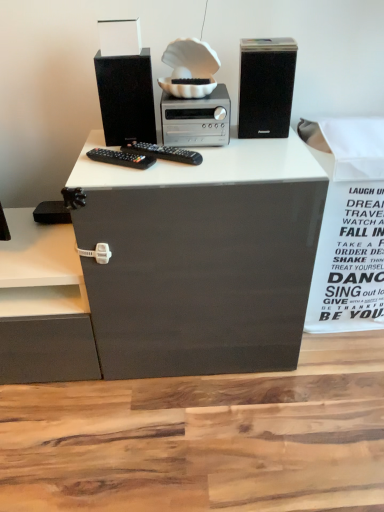
What is the approximate width of black matte speaker at upper right, the 2th computer tower when ordered from left to right?

The width of black matte speaker at upper right, the 2th computer tower when ordered from left to right, is 5.47 inches.

Identify the location of white paper at right. (348, 226).

Identify the location of silver metallic stereo at center. Image resolution: width=384 pixels, height=512 pixels. (196, 119).

Describe the element at coordinates (126, 98) in the screenshot. I see `matte black speaker at upper left, which ranks as the 1th computer tower in left-to-right order` at that location.

Identify the location of black matte speaker at upper right, which is the 1th computer tower in right-to-left order. (266, 87).

Is black matte speaker at upper right, the 2th computer tower when ordered from left to right, in front of or behind silver metallic stereo at center in the image?

Clearly, black matte speaker at upper right, the 2th computer tower when ordered from left to right, is in front of silver metallic stereo at center.

Would you say black matte speaker at upper right, the 2th computer tower when ordered from left to right, is to the left or to the right of silver metallic stereo at center in the picture?

From the image, it's evident that black matte speaker at upper right, the 2th computer tower when ordered from left to right, is to the right of silver metallic stereo at center.

This screenshot has width=384, height=512. Identify the location of the 2nd computer tower positioned above the silver metallic stereo at center (from the image's perspective). (266, 87).

Are black matte speaker at upper right, the 2th computer tower when ordered from left to right, and silver metallic stereo at center beside each other?

There is a gap between black matte speaker at upper right, the 2th computer tower when ordered from left to right, and silver metallic stereo at center.

Can you confirm if black matte speaker at upper right, the 2th computer tower when ordered from left to right, is positioned to the right of matte black speaker at upper left, the second computer tower from the right?

Correct, you'll find black matte speaker at upper right, the 2th computer tower when ordered from left to right, to the right of matte black speaker at upper left, the second computer tower from the right.

Where is `computer tower that is in front of the black matte speaker at upper right, the 2th computer tower when ordered from left to right`? This screenshot has height=512, width=384. computer tower that is in front of the black matte speaker at upper right, the 2th computer tower when ordered from left to right is located at coordinates (126, 98).

Is black matte speaker at upper right, the 2th computer tower when ordered from left to right, taller than matte black speaker at upper left, which ranks as the 1th computer tower in left-to-right order?

Yes.

From a real-world perspective, which object stands above the other?

In real-world perspective, black matte speaker at upper right, the 2th computer tower when ordered from left to right, is above.

Is silver metallic stereo at center oriented away from white paper at right?

No, white paper at right is not at the back of silver metallic stereo at center.

From a real-world perspective, is silver metallic stereo at center located beneath white paper at right?

Actually, silver metallic stereo at center is physically above white paper at right in the real world.

Based on the photo, which of these two, silver metallic stereo at center or white paper at right, stands taller?

With more height is white paper at right.

Who is bigger, matte black speaker at upper left, the second computer tower from the right, or black matte speaker at upper right, which is the 1th computer tower in right-to-left order?

black matte speaker at upper right, which is the 1th computer tower in right-to-left order, is bigger.

Which is more to the right, matte black speaker at upper left, which ranks as the 1th computer tower in left-to-right order, or black matte speaker at upper right, which is the 1th computer tower in right-to-left order?

black matte speaker at upper right, which is the 1th computer tower in right-to-left order, is more to the right.

From a real-world perspective, is matte black speaker at upper left, the second computer tower from the right, positioned under black matte speaker at upper right, the 2th computer tower when ordered from left to right, based on gravity?

Indeed, from a real-world perspective, matte black speaker at upper left, the second computer tower from the right, is positioned beneath black matte speaker at upper right, the 2th computer tower when ordered from left to right.

Consider the image. Is matte black speaker at upper left, the second computer tower from the right, not close to black matte speaker at upper right, which is the 1th computer tower in right-to-left order?

matte black speaker at upper left, the second computer tower from the right, is near black matte speaker at upper right, which is the 1th computer tower in right-to-left order, not far away.

From the image's perspective, is silver metallic stereo at center below matte black speaker at upper left, which ranks as the 1th computer tower in left-to-right order?

Yes.

Does silver metallic stereo at center come behind matte black speaker at upper left, which ranks as the 1th computer tower in left-to-right order?

Yes, it is.

Is silver metallic stereo at center taller or shorter than matte black speaker at upper left, which ranks as the 1th computer tower in left-to-right order?

In the image, silver metallic stereo at center appears to be shorter than matte black speaker at upper left, which ranks as the 1th computer tower in left-to-right order.

This screenshot has width=384, height=512. In order to click on home appliance that is below the matte black speaker at upper left, the second computer tower from the right (from the image's perspective) in this screenshot , I will do `click(196, 119)`.

From a real-world perspective, which is physically above, black matte speaker at upper right, the 2th computer tower when ordered from left to right, or white paper at right?

From a 3D spatial view, black matte speaker at upper right, the 2th computer tower when ordered from left to right, is above.

How different are the orientations of black matte speaker at upper right, the 2th computer tower when ordered from left to right, and white paper at right in degrees?

They differ by 5.26 degrees in their facing directions.

Is black matte speaker at upper right, which is the 1th computer tower in right-to-left order, to the left or to the right of white paper at right in the image?

black matte speaker at upper right, which is the 1th computer tower in right-to-left order, is to the left of white paper at right.

Is the depth of black matte speaker at upper right, the 2th computer tower when ordered from left to right, less than that of white paper at right?

Yes, black matte speaker at upper right, the 2th computer tower when ordered from left to right, is in front of white paper at right.

This screenshot has width=384, height=512. I want to click on computer tower that is the 1st object located in front of the silver metallic stereo at center, so click(x=266, y=87).

Is silver metallic stereo at center far away from black matte speaker at upper right, which is the 1th computer tower in right-to-left order?

That's not correct — silver metallic stereo at center is a little close to black matte speaker at upper right, which is the 1th computer tower in right-to-left order.

Considering the relative sizes of silver metallic stereo at center and black matte speaker at upper right, the 2th computer tower when ordered from left to right, in the image provided, is silver metallic stereo at center thinner than black matte speaker at upper right, the 2th computer tower when ordered from left to right,?

No.

In the scene shown: Is silver metallic stereo at center not inside black matte speaker at upper right, which is the 1th computer tower in right-to-left order?

Absolutely, silver metallic stereo at center is external to black matte speaker at upper right, which is the 1th computer tower in right-to-left order.

Locate an element on the screen. This screenshot has width=384, height=512. home appliance below the black matte speaker at upper right, which is the 1th computer tower in right-to-left order (from a real-world perspective) is located at coordinates (196, 119).

Where is `computer tower behind the matte black speaker at upper left, which ranks as the 1th computer tower in left-to-right order`? The height and width of the screenshot is (512, 384). computer tower behind the matte black speaker at upper left, which ranks as the 1th computer tower in left-to-right order is located at coordinates (266, 87).

Considering their positions, is black matte speaker at upper right, the 2th computer tower when ordered from left to right, positioned closer to matte black speaker at upper left, the second computer tower from the right, than white paper at right?

The object closer to matte black speaker at upper left, the second computer tower from the right, is black matte speaker at upper right, the 2th computer tower when ordered from left to right.

From the image, which object appears to be farther from white paper at right, black matte speaker at upper right, which is the 1th computer tower in right-to-left order, or matte black speaker at upper left, which ranks as the 1th computer tower in left-to-right order?

The object further to white paper at right is matte black speaker at upper left, which ranks as the 1th computer tower in left-to-right order.

Based on their spatial positions, is matte black speaker at upper left, the second computer tower from the right, or silver metallic stereo at center further from black matte speaker at upper right, which is the 1th computer tower in right-to-left order?

The object further to black matte speaker at upper right, which is the 1th computer tower in right-to-left order, is matte black speaker at upper left, the second computer tower from the right.

Considering their positions, is silver metallic stereo at center positioned closer to matte black speaker at upper left, the second computer tower from the right, than white paper at right?

silver metallic stereo at center lies closer to matte black speaker at upper left, the second computer tower from the right, than the other object.

From the image, which object appears to be farther from silver metallic stereo at center, white paper at right or matte black speaker at upper left, the second computer tower from the right?

Among the two, white paper at right is located further to silver metallic stereo at center.

When comparing their distances from black matte speaker at upper right, the 2th computer tower when ordered from left to right, does silver metallic stereo at center or matte black speaker at upper left, the second computer tower from the right, seem further?

matte black speaker at upper left, the second computer tower from the right, is positioned further to the anchor black matte speaker at upper right, the 2th computer tower when ordered from left to right.

Which object lies further to the anchor point matte black speaker at upper left, the second computer tower from the right, silver metallic stereo at center or black matte speaker at upper right, which is the 1th computer tower in right-to-left order?

black matte speaker at upper right, which is the 1th computer tower in right-to-left order, is positioned further to the anchor matte black speaker at upper left, the second computer tower from the right.

From the image, which object appears to be farther from white paper at right, black matte speaker at upper right, the 2th computer tower when ordered from left to right, or silver metallic stereo at center?

Among the two, silver metallic stereo at center is located further to white paper at right.

Find the location of a particular element. The height and width of the screenshot is (512, 384). computer tower situated between matte black speaker at upper left, the second computer tower from the right, and white paper at right from left to right is located at coordinates (266, 87).

Find the location of a particular element. This screenshot has width=384, height=512. computer tower between silver metallic stereo at center and white paper at right in the horizontal direction is located at coordinates (266, 87).

Identify the location of home appliance located between matte black speaker at upper left, which ranks as the 1th computer tower in left-to-right order, and black matte speaker at upper right, which is the 1th computer tower in right-to-left order, in the left-right direction. (196, 119).

Locate an element on the screen. The height and width of the screenshot is (512, 384). home appliance located between matte black speaker at upper left, the second computer tower from the right, and white paper at right in the left-right direction is located at coordinates tap(196, 119).